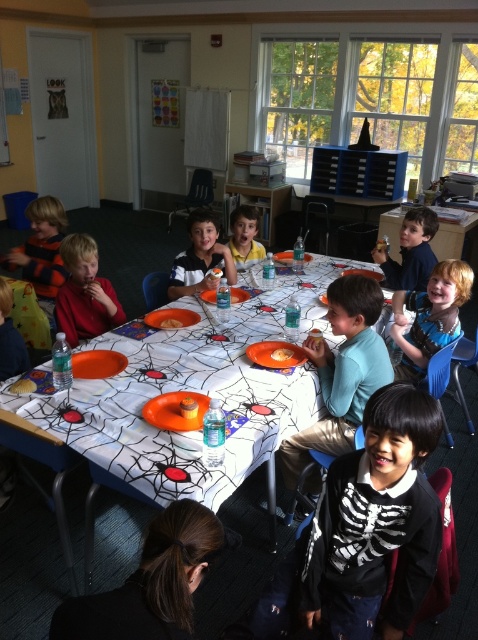
You are a photographer taking a picture of the matte blue shirt at upper center and the orange plastic plate at center. Which object will appear closer to you in the photo?

The matte blue shirt at upper center will appear closer to you in the photo because it is positioned further to the viewer than the orange plastic plate at center.

You are planning to place a decorative banner on the wall behind the matte blue shirt at upper center. According to the coordinates provided, where should you position the banner to ensure it is centered above the shirt?

The matte blue shirt at upper center is located at point coordinates (411,252). To center the banner above it, position the banner at the same x coordinate, 0.394, and adjust the y coordinate slightly higher to ensure it is centered above the shirt.

You are a photographer trying to capture a group photo of the children at the Halloween party. You notice the light blue shirt at center and the striped sweater at left. Which child should you ask to stand up slightly to ensure both are visible in the photo?

The striped sweater at left should be asked to stand up since the light blue shirt at center is already taller, ensuring both can be seen clearly.